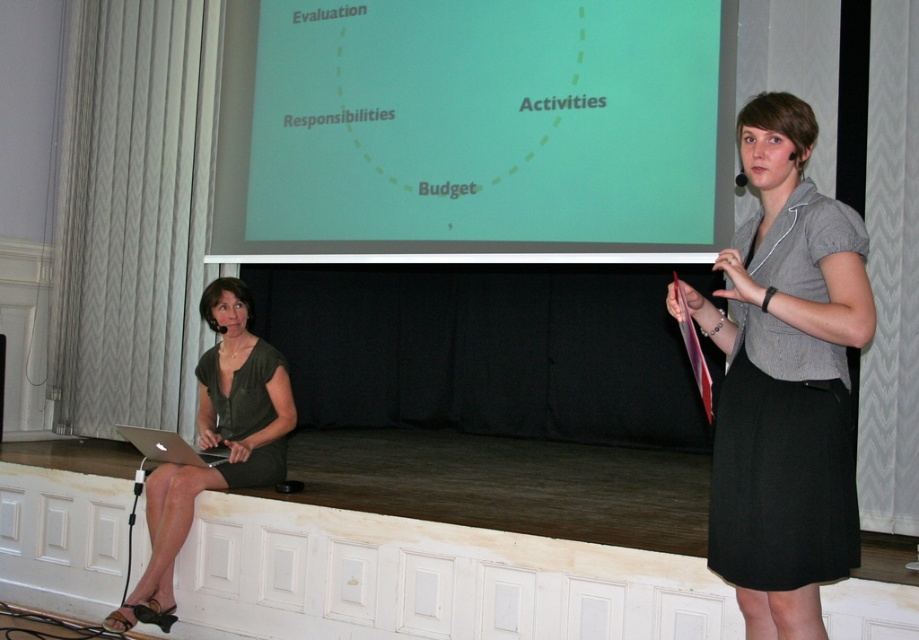
Question: Which of the following is the farthest from the observer?

Choices:
 (A) matte black laptop at left
 (B) green matte dress at lower left

Answer: (A)

Question: Is the position of green matte projection screen at center less distant than that of matte black laptop at left?

Choices:
 (A) no
 (B) yes

Answer: (B)

Question: Does gray fabric shirt at upper right lie behind matte black laptop at left?

Choices:
 (A) no
 (B) yes

Answer: (A)

Question: Is green matte dress at lower left to the right of silver metallic laptop at lower left from the viewer's perspective?

Choices:
 (A) no
 (B) yes

Answer: (B)

Question: Which point is farther to the camera?

Choices:
 (A) green matte projection screen at center
 (B) gray fabric shirt at upper right
 (C) green matte dress at left
 (D) silver metallic laptop at lower left

Answer: (C)

Question: Which of the following is the farthest from the observer?

Choices:
 (A) green matte projection screen at center
 (B) silver metallic laptop at lower left
 (C) matte black laptop at left
 (D) green matte dress at lower left

Answer: (C)